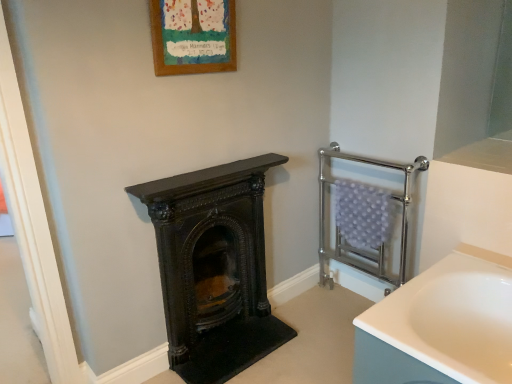
Locate an element on the screen. vacant space underneath black polished wood burning stove at center (from a real-world perspective) is located at coordinates (225, 329).